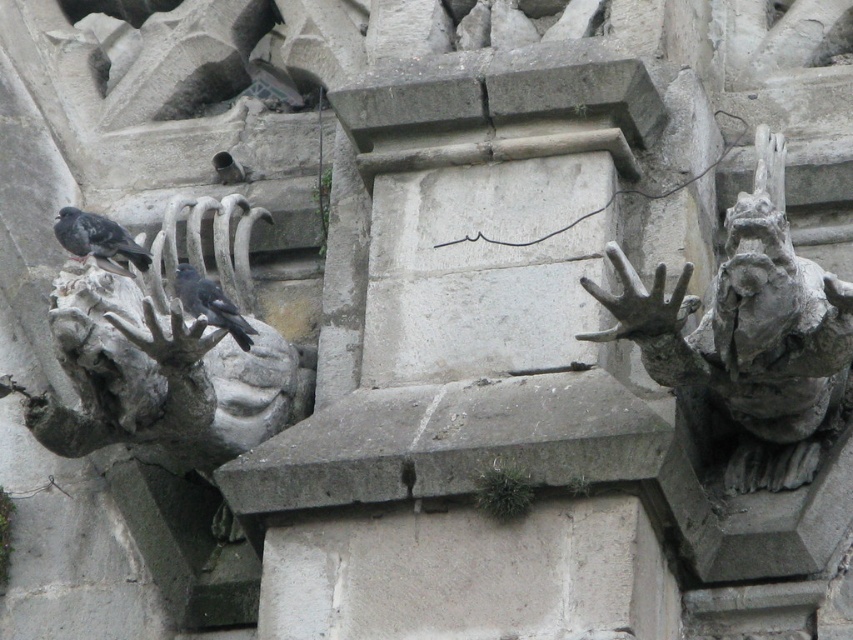
Question: Does gray matte pigeon at left have a smaller size compared to gray matte bird at center?

Choices:
 (A) yes
 (B) no

Answer: (B)

Question: Which object is positioned farthest from the gray stone gargoyle at right?

Choices:
 (A) gray matte bird at center
 (B) gray matte pigeon at left

Answer: (B)

Question: Based on their relative distances, which object is nearer to the gray matte pigeon at left?

Choices:
 (A) gray matte bird at center
 (B) gray stone gargoyle at right

Answer: (A)

Question: Can you confirm if gray matte pigeon at left is wider than gray matte bird at center?

Choices:
 (A) yes
 (B) no

Answer: (A)

Question: Which point appears closest to the camera in this image?

Choices:
 (A) (628, 314)
 (B) (132, 250)
 (C) (210, 296)

Answer: (A)

Question: Is gray stone gargoyle at right behind gray matte bird at center?

Choices:
 (A) yes
 (B) no

Answer: (B)